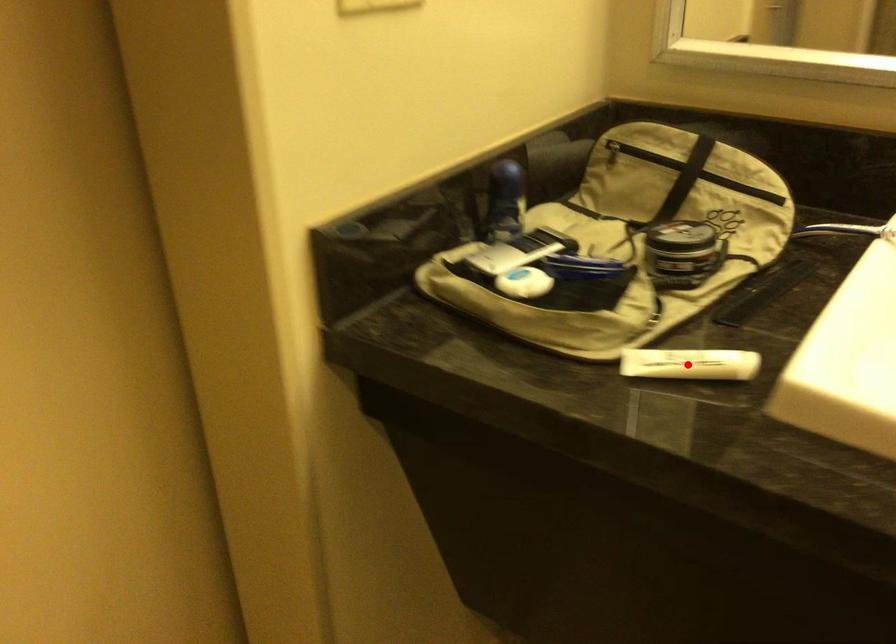
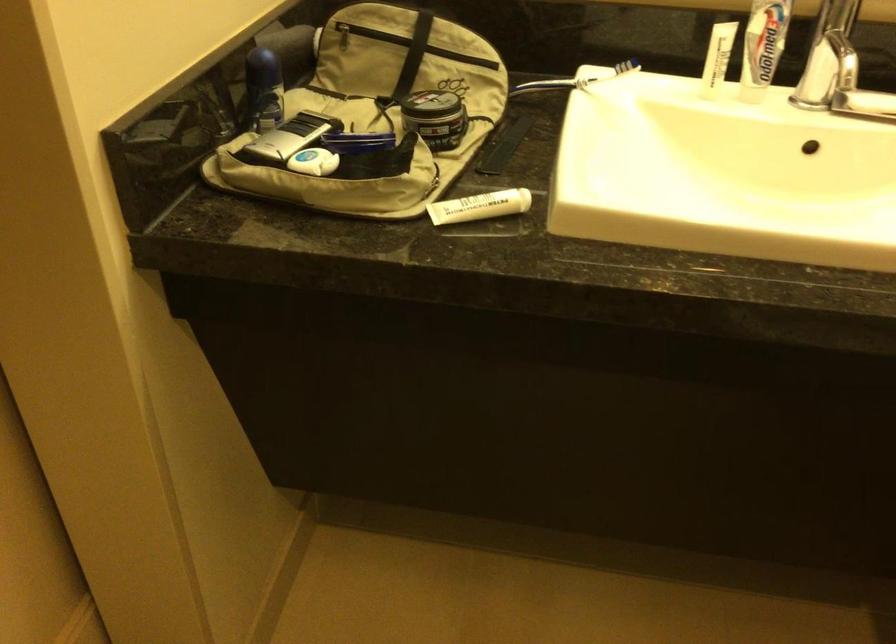
Find the pixel in the second image that matches the highlighted location in the first image.

(479, 205)